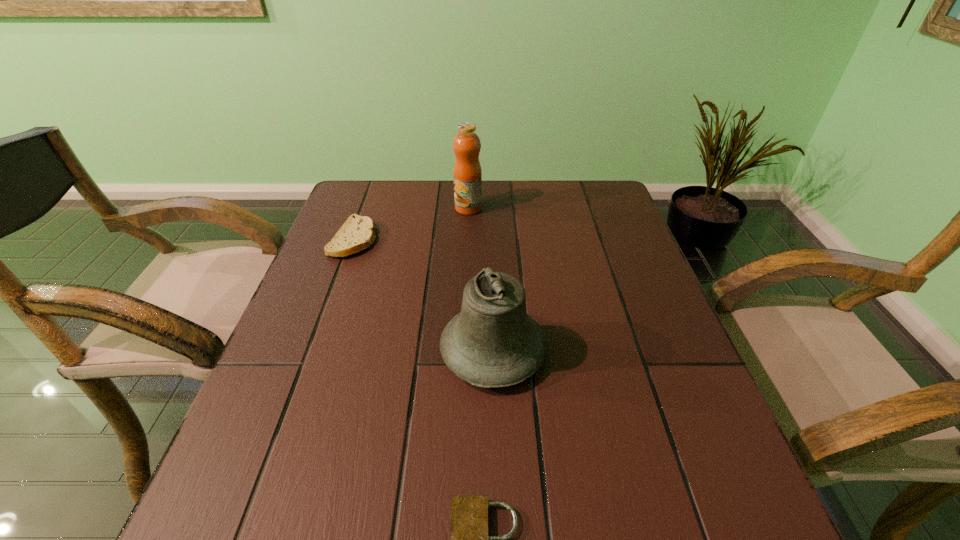
Identify the location of the farthest object. (467, 173).

Locate an element on the screen. the tallest object is located at coordinates (467, 173).

Where is `the second nearest object`? the second nearest object is located at coordinates (493, 342).

Identify the location of bell. (493, 342).

Where is `pita bread`? pita bread is located at coordinates (357, 234).

The height and width of the screenshot is (540, 960). I want to click on the third tallest object, so click(357, 234).

Find the location of a particular element. The image size is (960, 540). vacant space located on the right of the tallest object is located at coordinates (x=534, y=208).

You are a GUI agent. You are given a task and a screenshot of the screen. Output one action in this format:
    pyautogui.click(x=<x>, y=<y>)
    Task: Click on the vacant position located 0.170m on the right of the third farthest object
    The image size is (960, 540).
    Given the screenshot: What is the action you would take?
    pyautogui.click(x=631, y=352)

What are the coordinates of `free location located 0.390m on the right of the pita bread` in the screenshot? It's located at (525, 239).

At what (x,y) coordinates should I click in order to perform the action: click on fruit juice that is at the far edge. Please return your answer as a coordinate pair (x, y). The image size is (960, 540). Looking at the image, I should click on (467, 173).